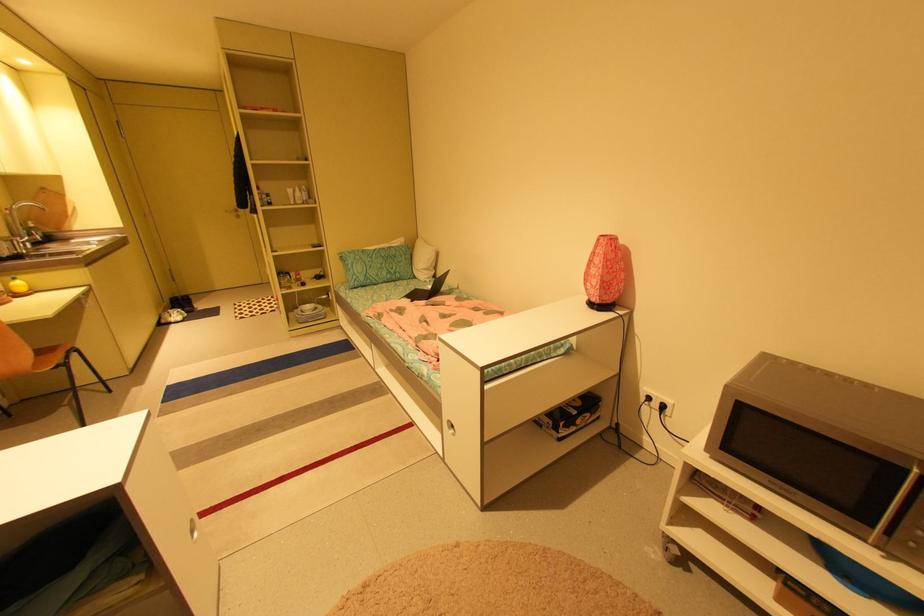
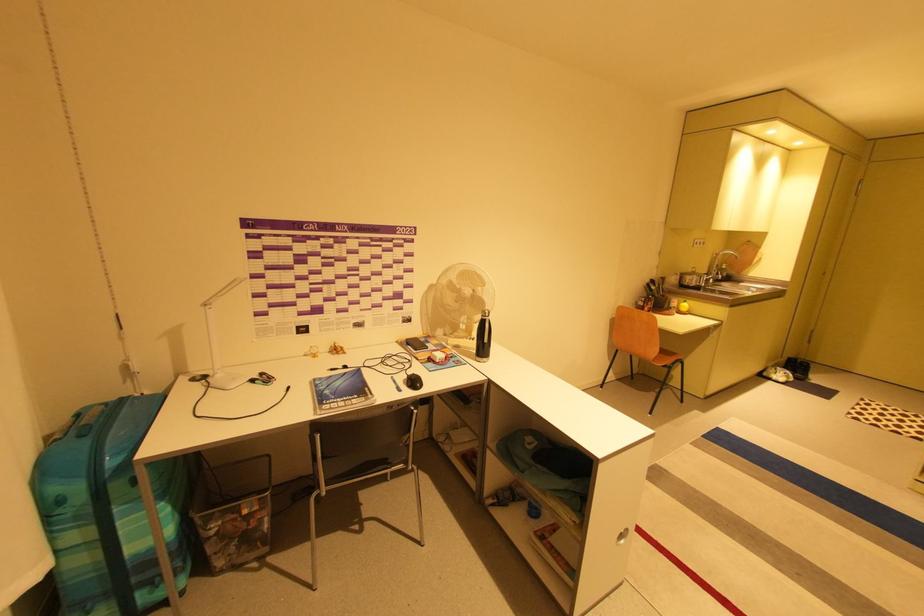
First-person continuous shooting, in which direction is the camera rotating?

The camera rotated toward left-down.